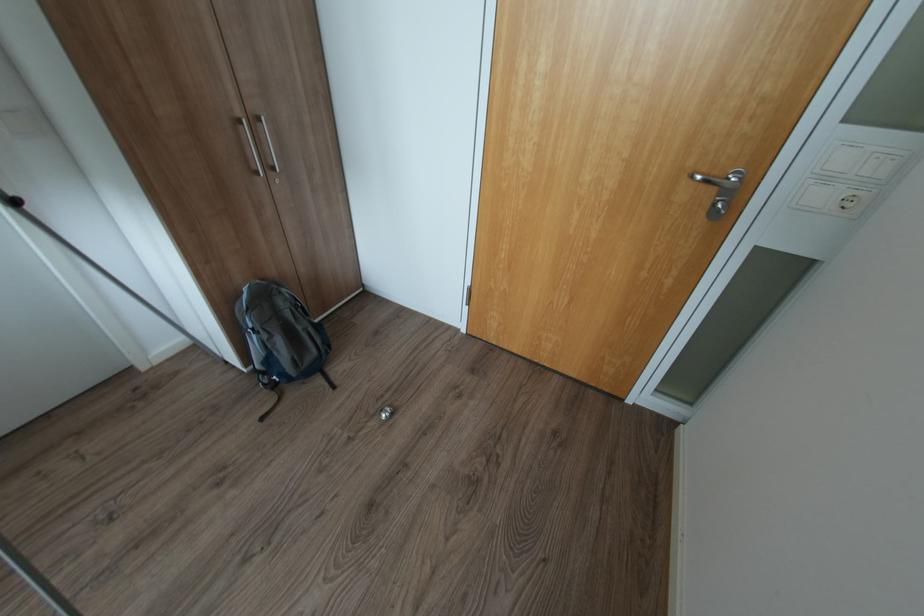
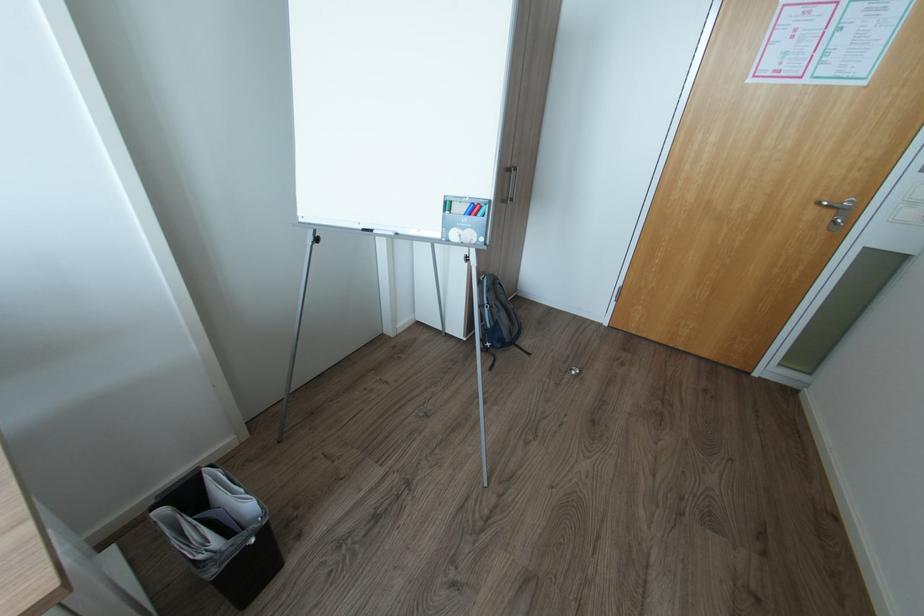
The point at (281, 378) is marked in the first image. Where is the corresponding point in the second image?

(492, 344)